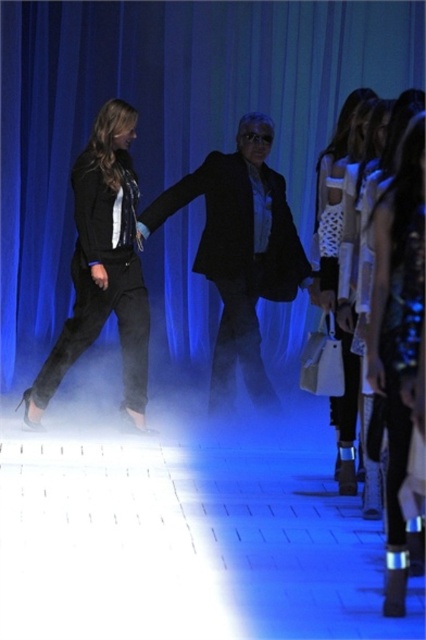
You are a photographer positioned at the end of the runway. You need to take a photo of both the matte black suit at center and the black matte blazer at left. Which one is closer to you?

The matte black suit at center is closer to you because the black matte blazer at left is behind it.

You are a photographer standing on the runway. You need to capture a photo that includes both the black matte blazer at left and the white textured sweater at center. What is the minimum distance you need to move backward to ensure both items are in frame?

The black matte blazer at left and white textured sweater at center are 5.78 feet apart. To include both in the frame, you need to move back at least 5.78 feet to ensure the camera can capture the entire distance between them.